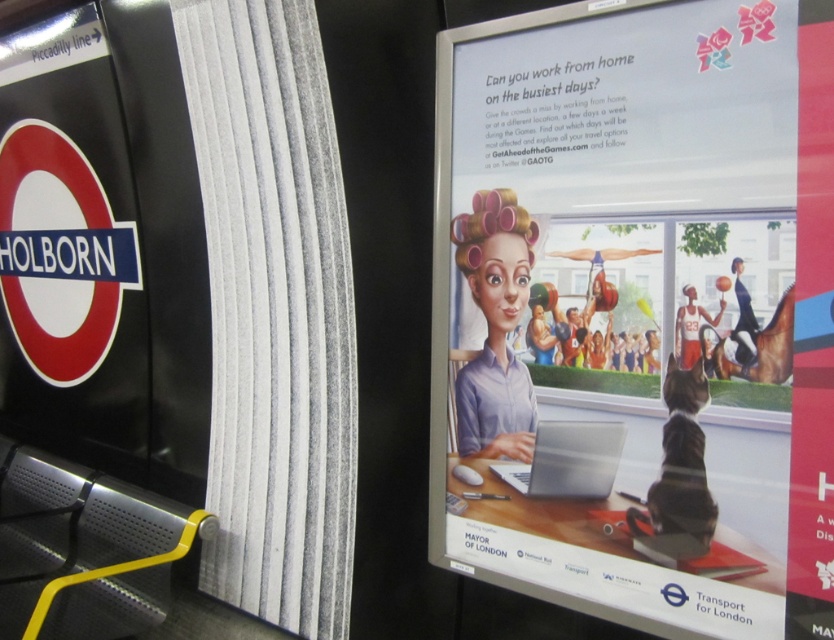
You are a commuter in a subway station and need to read both the metallic silver signboard at left and the silver metallic laptop at center. Which object will require you to move closer to read its content?

The silver metallic laptop at center requires you to move closer because it is smaller than the metallic silver signboard at left.

You are organizing a presentation and need to place a matte white laptop at center and a metallic silver signboard at left on a table. Which object requires more horizontal space on the table?

The metallic silver signboard at left requires more horizontal space on the table because it has a greater width than the matte white laptop at center.